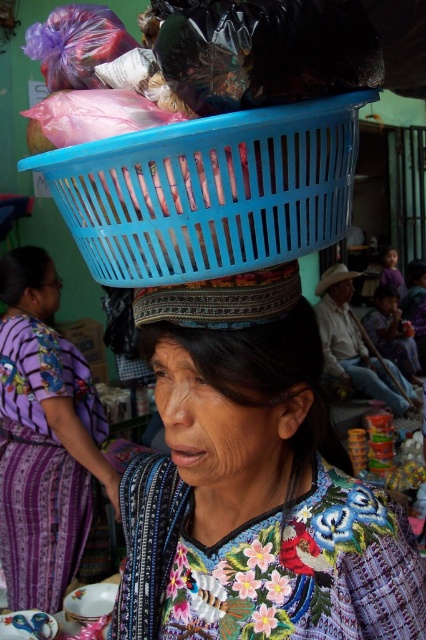
Is matte brown hat at center below smooth skin head at center?

Yes.

Can you confirm if matte brown hat at center is smaller than smooth skin head at center?

No, matte brown hat at center is not smaller than smooth skin head at center.

Which is behind, point (342, 269) or point (394, 264)?

Point (394, 264)

Image resolution: width=426 pixels, height=640 pixels. I want to click on matte brown hat at center, so click(x=333, y=276).

Which is above, matte purple dress at lower left or dark brown woven hat at center?

dark brown woven hat at center is higher up.

Between matte purple dress at lower left and dark brown woven hat at center, which one appears on the left side from the viewer's perspective?

matte purple dress at lower left

Does point (14, 252) come closer to viewer compared to point (422, 268)?

Yes, point (14, 252) is closer to viewer.

You are a GUI agent. You are given a task and a screenshot of the screen. Output one action in this format:
    pyautogui.click(x=<x>, y=<y>)
    Task: Click on the matte purple dress at lower left
    This screenshot has height=640, width=426.
    Given the screenshot: What is the action you would take?
    pyautogui.click(x=29, y=282)

Measure the distance between embroidered fabric dress at center and textured fabric headscarf at center.

The distance of embroidered fabric dress at center from textured fabric headscarf at center is 4.69 feet.

Between embroidered fabric dress at center and textured fabric headscarf at center, which one is positioned lower?

embroidered fabric dress at center

Is point (63, 380) positioned in front of point (296, 492)?

No, it is behind (296, 492).

At what (x,y) coordinates should I click in order to perform the action: click on embroidered fabric dress at center. Please return your answer as a coordinate pair (x, y). Looking at the image, I should click on (45, 438).